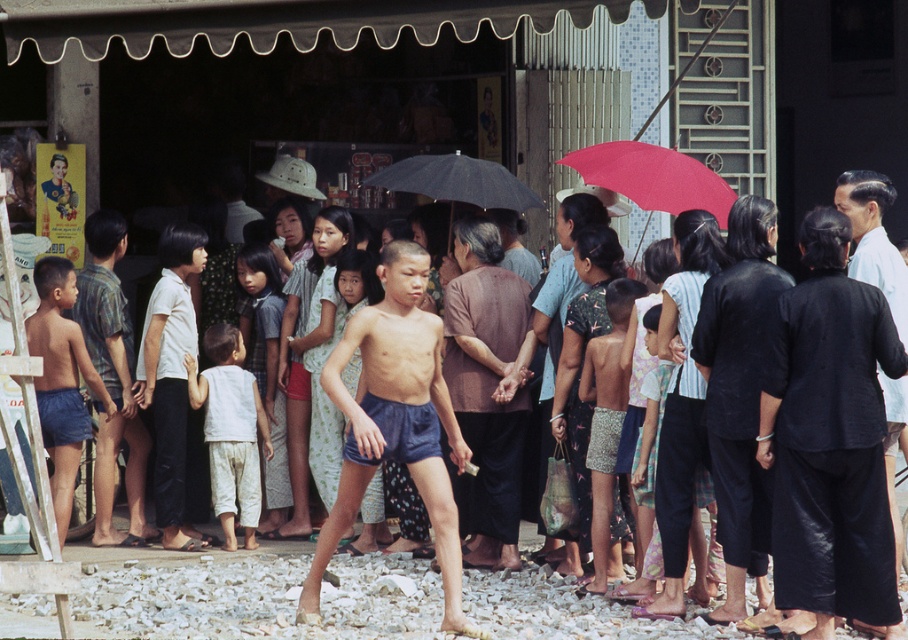
You are a photographer trying to capture a closeup of the matte blue shorts at center and the printed fabric shorts at center in the scene. If you want to ensure both are fully visible in the frame without cropping, which pair of shorts should you focus on first to adjust your camera angle?

You should focus on adjusting your camera angle for the matte blue shorts at center first since they might be wider than the printed fabric shorts at center, requiring more space in the frame to capture fully.

You are a photographer trying to capture the brown fabric shirt at center in your shot. Given that your camera has a focal point at coordinates 0.5, 0.5, will the shirt be in focus?

The brown fabric shirt at center is located at point (486, 387), which is slightly to the right and above the camera focal point at (454, 320). Depending on the camera lens and depth of field, it might be in focus but not perfectly centered. Adjust the camera position slightly to the right and up for better focus.